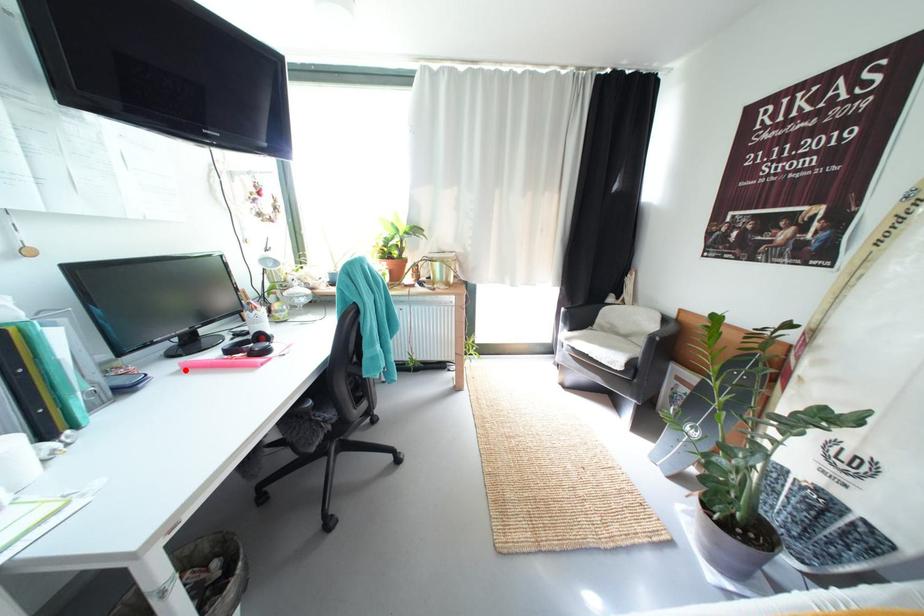
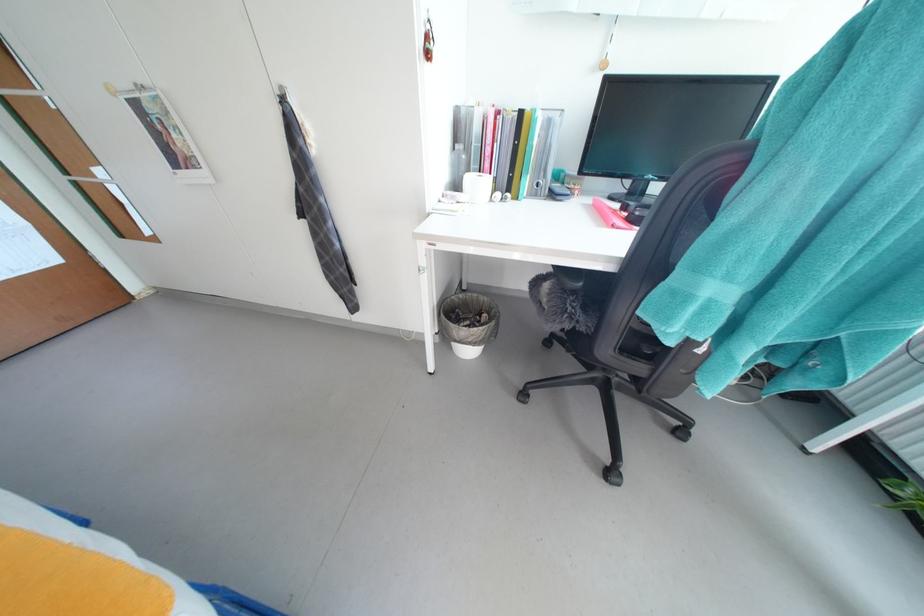
In the second image, find the point that corresponds to the highlighted location in the first image.

(599, 204)